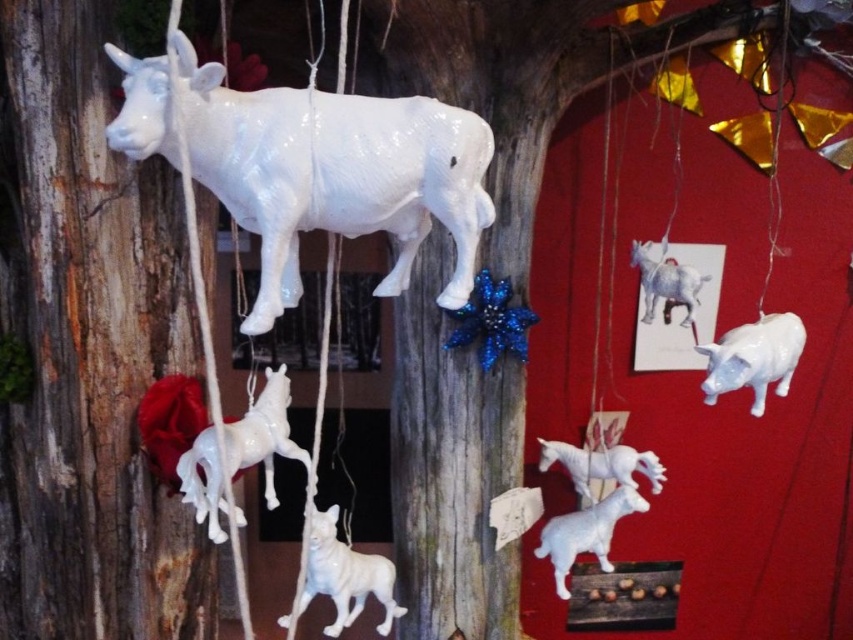
Question: Is white glossy lamb at center smaller than white glossy goat at upper center?

Choices:
 (A) no
 (B) yes

Answer: (B)

Question: Is smooth wood tree trunk at left smaller than white glossy horse at lower left?

Choices:
 (A) no
 (B) yes

Answer: (A)

Question: Which object appears closest to the camera in this image?

Choices:
 (A) wooden post at center
 (B) white glossy pig at right
 (C) white glossy horse at lower left

Answer: (C)

Question: Which point is closer to the camera taking this photo?

Choices:
 (A) (254, 428)
 (B) (468, 136)
 (C) (573, 454)

Answer: (B)

Question: Which of the following is the closest to the observer?

Choices:
 (A) white glossy cow at upper left
 (B) white glossy pig at right
 (C) white glossy lamb at center

Answer: (A)

Question: Is smooth wood tree trunk at left above white glossy horse at lower left?

Choices:
 (A) no
 (B) yes

Answer: (B)